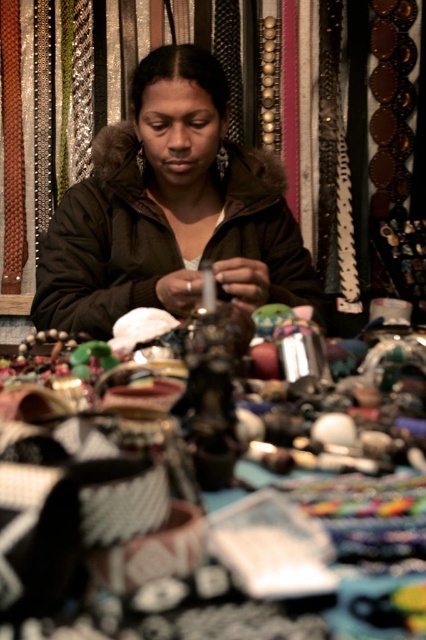
You are a customer at the market stall and want to pick up the metallic silver bangles at center and the matte brown jacket at center. If your arms can reach 26 inches, can you grab both items at the same time?

The metallic silver bangles at center and the matte brown jacket at center are 25.57 inches apart from each other. Since your arms can reach 26 inches, you can grab both items at the same time.

In the scene shown: You are standing at the point marked as point (22, 554) in the image. You want to place a small package that is 10 inches in length on the floor. Can you fit the package entirely within the space between you and the viewer?

The distance between point (22, 554) and the viewer is 9.60 inches. Since the package is 10 inches long, it cannot be placed entirely within this space as it is longer than the available distance.